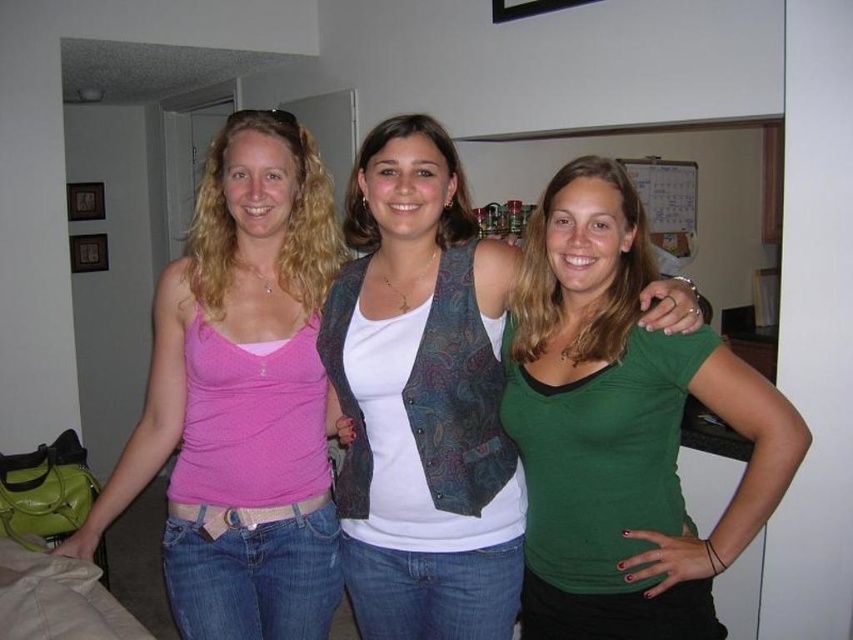
You are trying to decide which top to wear for a casual day out. You have the pink matte tank top at left and the green matte shirt at center. Based on the image, which top is visible more on the upper body?

The pink matte tank top at left is positioned over the green matte shirt at center, so the pink matte tank top at left is more visible on the upper body.

You are a fashion designer analyzing the image. You need to determine which object is located at the coordinates point (242,397). Which object is it?

The point (242,397) corresponds to the pink matte tank top at left.

You are standing in the living room and see the pink matte tank top at left and the green matte shirt at center. Which one is closer to you?

The pink matte tank top at left is closer to you because it is further to the viewer than the green matte shirt at center.